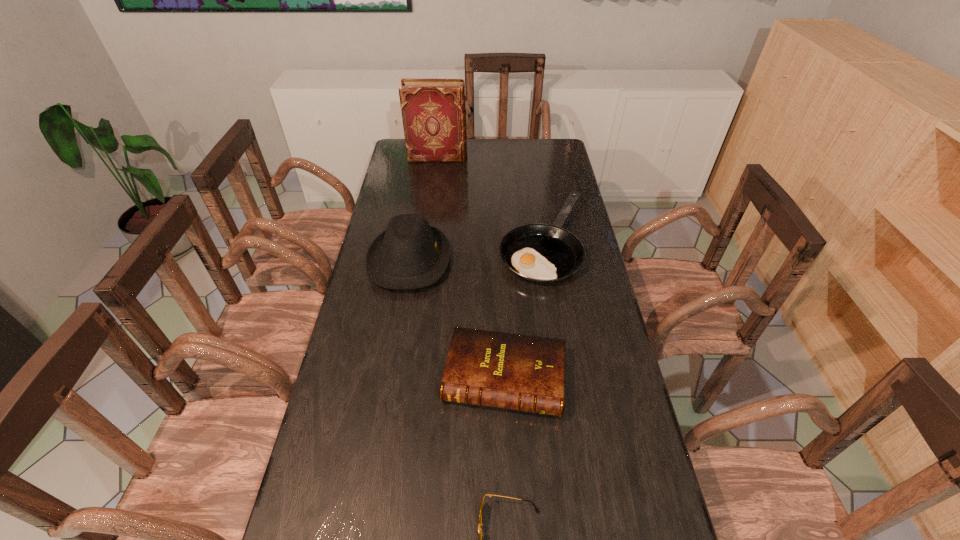
Identify the location of the farther hardback book. (433, 111).

Image resolution: width=960 pixels, height=540 pixels. What are the coordinates of `the farthest object` in the screenshot? It's located at (433, 111).

Find the location of a particular element. the second tallest object is located at coordinates (410, 254).

At what (x,y) coordinates should I click in order to perform the action: click on frying pan. Please return your answer as a coordinate pair (x, y). This screenshot has width=960, height=540. Looking at the image, I should click on coord(543,253).

Image resolution: width=960 pixels, height=540 pixels. What are the coordinates of `the shorter hardback book` in the screenshot? It's located at (526, 373).

What are the coordinates of `the nearer hardback book` in the screenshot? It's located at (526, 373).

You are a GUI agent. You are given a task and a screenshot of the screen. Output one action in this format:
    pyautogui.click(x=<x>, y=<y>)
    Task: Click on the vacant point located on the spine side of the farthest object
    The image size is (960, 540).
    Given the screenshot: What is the action you would take?
    pyautogui.click(x=492, y=157)

Identify the location of vacant space situated on the front-facing side of the fedora. point(568,260).

Where is `vacant space located on the left of the frying pan`? This screenshot has width=960, height=540. vacant space located on the left of the frying pan is located at coordinates (408, 242).

The height and width of the screenshot is (540, 960). In order to click on blank area located on the back of the second nearest object in this screenshot , I will do `click(500, 276)`.